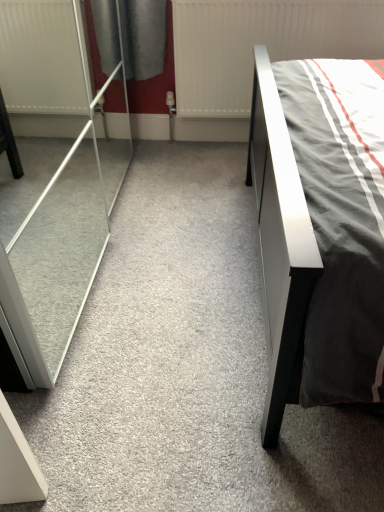
Locate an element on the screen. The image size is (384, 512). vacant area situated below transparent glass screen door at left (from a real-world perspective) is located at coordinates (51, 238).